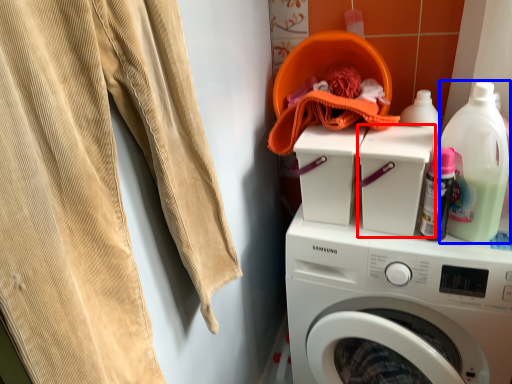
Question: Which of the following is the farthest to the observer, appliance (highlighted by a red box) or cleaning product (highlighted by a blue box)?

Choices:
 (A) appliance
 (B) cleaning product

Answer: (A)